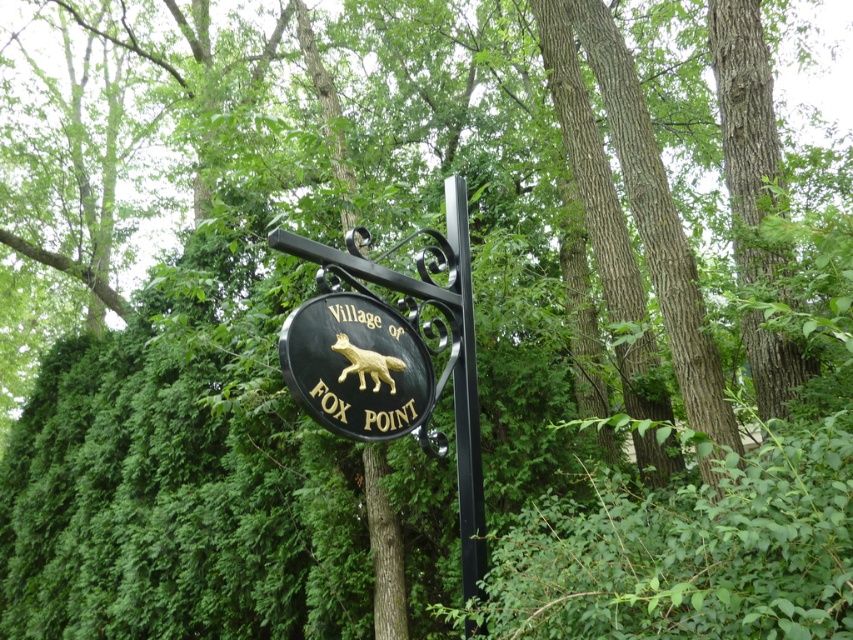
Between point (369, 275) and point (457, 324), which one is positioned in front?

Point (369, 275) is in front.

Consider the image. Is gold metallic fox at center bigger than black metal pole at center?

Yes.

Find the location of `gold metallic fox at center`. gold metallic fox at center is located at coordinates (392, 353).

Based on the photo, can you confirm if gold metallic fox at center is positioned to the right of black polished wood sign at center?

Indeed, gold metallic fox at center is positioned on the right side of black polished wood sign at center.

Between gold metallic fox at center and black polished wood sign at center, which one has less height?

With less height is black polished wood sign at center.

Is point (468, 508) farther from viewer compared to point (368, 371)?

Yes, it is behind point (368, 371).

You are a GUI agent. You are given a task and a screenshot of the screen. Output one action in this format:
    pyautogui.click(x=<x>, y=<y>)
    Task: Click on the gold metallic fox at center
    
    Given the screenshot: What is the action you would take?
    pyautogui.click(x=392, y=353)

Who is positioned more to the left, black polished wood sign at center or black metal pole at center?

black polished wood sign at center is more to the left.

Can you confirm if black polished wood sign at center is bigger than black metal pole at center?

No, black polished wood sign at center is not bigger than black metal pole at center.

Describe the element at coordinates (357, 368) in the screenshot. I see `black polished wood sign at center` at that location.

What are the coordinates of `black polished wood sign at center` in the screenshot? It's located at (357, 368).